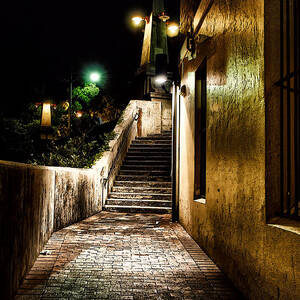
Where is `white light`? The height and width of the screenshot is (300, 300). white light is located at coordinates (161, 81).